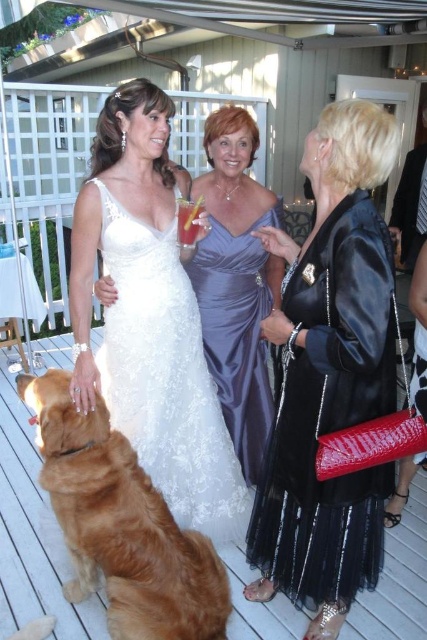
Question: Does white lace dress at center appear over golden fur dog at lower left?

Choices:
 (A) yes
 (B) no

Answer: (A)

Question: Which object appears farthest from the camera in this image?

Choices:
 (A) translucent glass at center
 (B) black satin clutch at lower right
 (C) white lace dress at center
 (D) golden fur dog at lower left

Answer: (A)

Question: Which of these objects is positioned farthest from the golden fur dog at lower left?

Choices:
 (A) satin dress at center
 (B) black satin clutch at lower right
 (C) white lace dress at center
 (D) translucent glass at center

Answer: (D)

Question: In this image, where is black satin clutch at lower right located relative to satin dress at center?

Choices:
 (A) left
 (B) right

Answer: (B)

Question: Which point is farther to the camera?

Choices:
 (A) (233, 284)
 (B) (356, 538)
 (C) (60, 422)

Answer: (A)

Question: Is black satin clutch at lower right closer to the viewer compared to white lace dress at center?

Choices:
 (A) yes
 (B) no

Answer: (A)